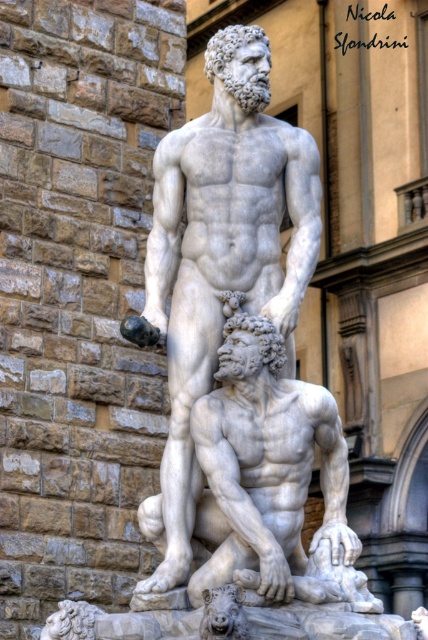
Question: Which object appears farthest from the camera in this image?

Choices:
 (A) white marble statue at center
 (B) white marble man at center

Answer: (B)

Question: Does white marble statue at center have a larger size compared to white marble man at center?

Choices:
 (A) no
 (B) yes

Answer: (B)

Question: Is the position of white marble statue at center more distant than that of white marble man at center?

Choices:
 (A) yes
 (B) no

Answer: (B)

Question: Is white marble statue at center positioned at the back of white marble man at center?

Choices:
 (A) yes
 (B) no

Answer: (B)

Question: Which point is farther to the camera?

Choices:
 (A) white marble statue at center
 (B) white marble man at center

Answer: (B)